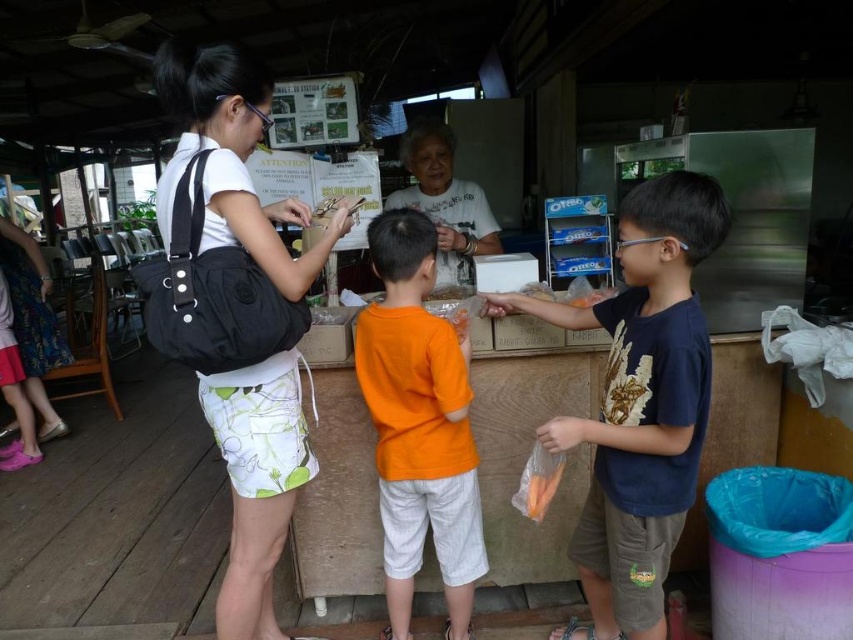
Which is more to the left, dark blue t-shirt at center or white matte shirt at center?

white matte shirt at center is more to the left.

Which of these two, dark blue t-shirt at center or white matte shirt at center, stands shorter?

white matte shirt at center is shorter.

Does point (699, 179) lie behind point (463, 237)?

That is False.

The width and height of the screenshot is (853, 640). I want to click on dark blue t-shirt at center, so click(640, 403).

What do you see at coordinates (418, 424) in the screenshot?
I see `orange cotton shirt at center` at bounding box center [418, 424].

Is point (437, 456) in front of point (543, 513)?

No.

You are a GUI agent. You are given a task and a screenshot of the screen. Output one action in this format:
    pyautogui.click(x=<x>, y=<y>)
    Task: Click on the orange cotton shirt at center
    The image size is (853, 640).
    Given the screenshot: What is the action you would take?
    tap(418, 424)

Which of these two, dark blue t-shirt at center or black fabric bag at center, stands taller?

Standing taller between the two is black fabric bag at center.

Locate an element on the screen. The height and width of the screenshot is (640, 853). dark blue t-shirt at center is located at coordinates click(640, 403).

Is point (612, 522) behind point (271, 632)?

No.

In order to click on dark blue t-shirt at center in this screenshot , I will do `click(640, 403)`.